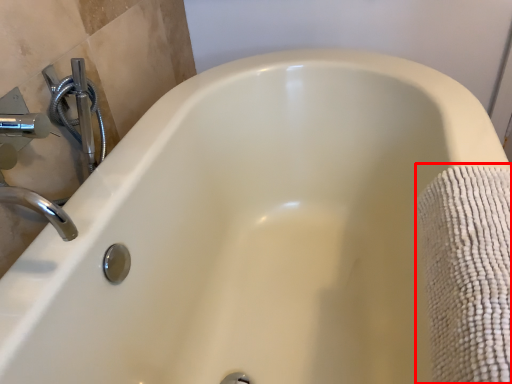
Question: In this image, where is bath towel (annotated by the red box) located relative to plumbing fixture?

Choices:
 (A) left
 (B) right

Answer: (B)